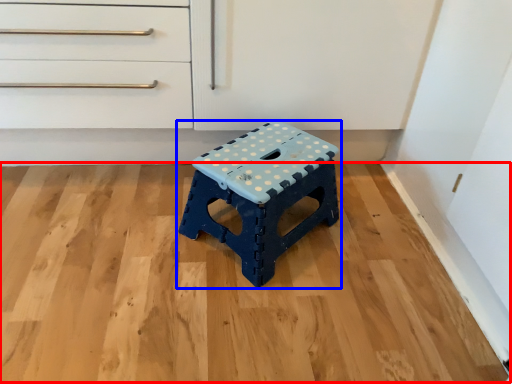
Question: Among these objects, which one is nearest to the camera, hardwood (highlighted by a red box) or stool (highlighted by a blue box)?

Choices:
 (A) hardwood
 (B) stool

Answer: (A)